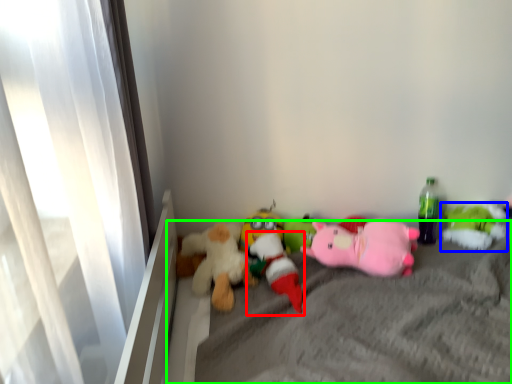
Question: Which object is positioned closest to toy (highlighted by a red box)? Select from toy (highlighted by a blue box) and mattress (highlighted by a green box).

Choices:
 (A) toy
 (B) mattress

Answer: (B)